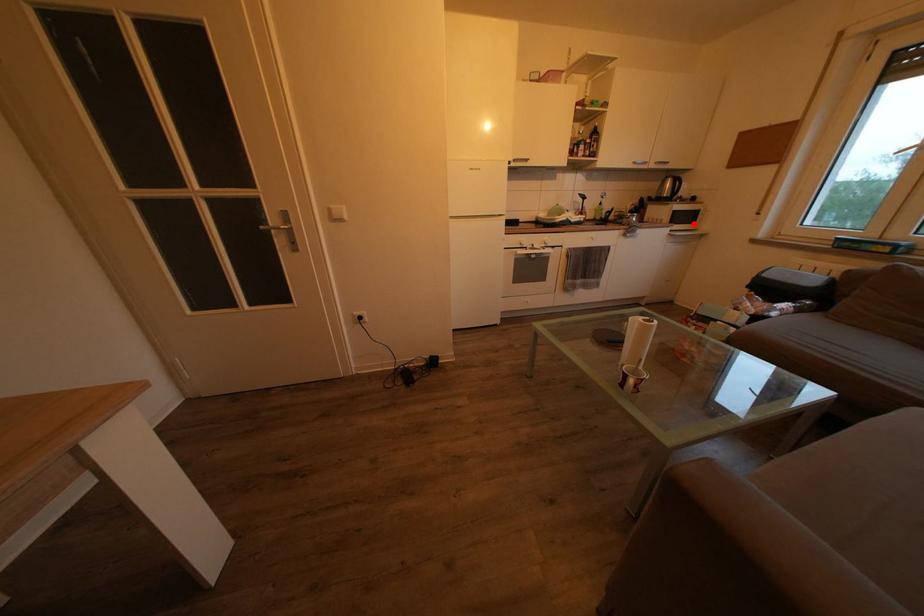
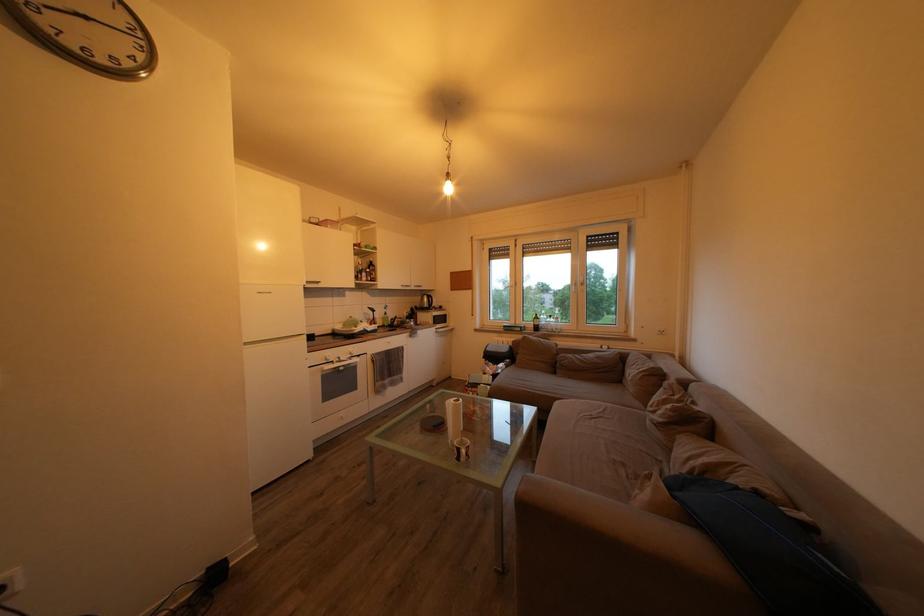
The point at the highlighted location is marked in the first image. Where is the corresponding point in the second image?

(448, 326)